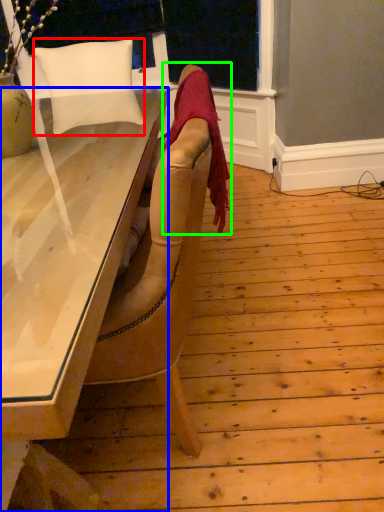
Question: Considering the real-world distances, which object is farthest from pillow (highlighted by a red box)? desk (highlighted by a blue box) or blanket (highlighted by a green box)?

Choices:
 (A) desk
 (B) blanket

Answer: (B)